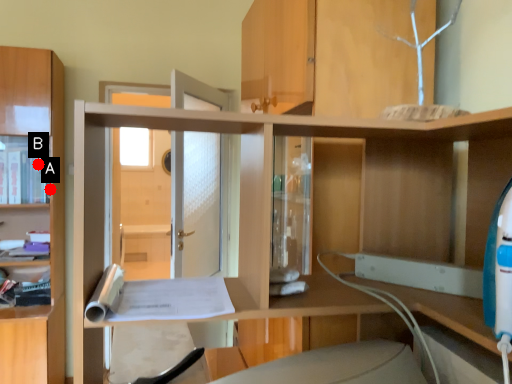
Question: Two points are circled on the image, labeled by A and B beside each circle. Which of the following is the closest to the observer?

Choices:
 (A) A is closer
 (B) B is closer

Answer: (A)